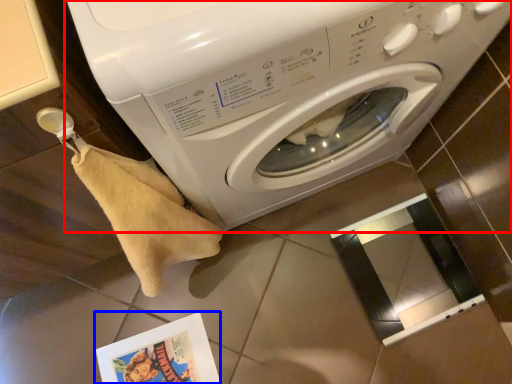
Question: Which object is closer to the camera taking this photo, washing machine (highlighted by a red box) or comic book (highlighted by a blue box)?

Choices:
 (A) washing machine
 (B) comic book

Answer: (A)